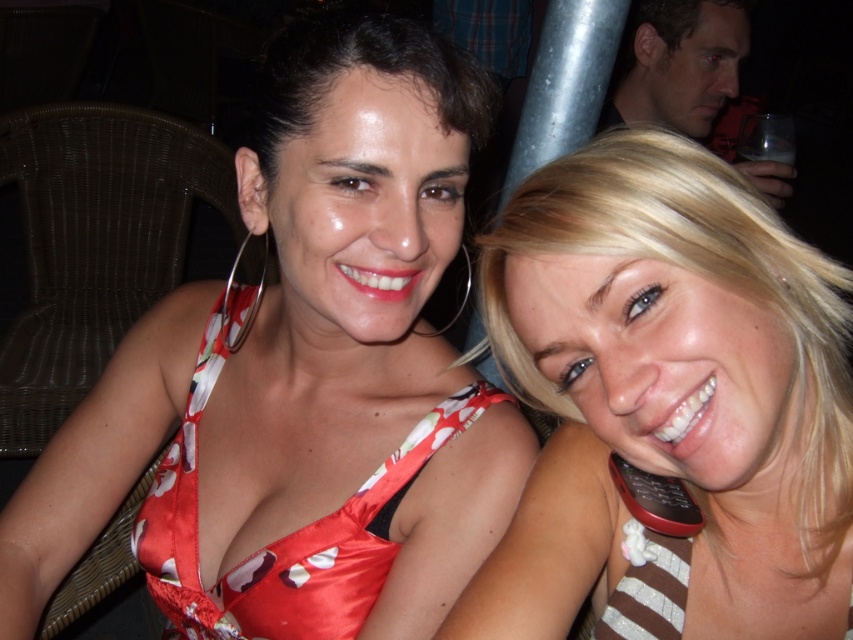
Question: Can you confirm if floral satin dress at center is positioned to the right of smooth glass at upper right?

Choices:
 (A) no
 (B) yes

Answer: (A)

Question: Does blonde hair at right appear on the left side of satin floral bikini top at center?

Choices:
 (A) no
 (B) yes

Answer: (A)

Question: Which of the following is the closest to the observer?

Choices:
 (A) (289, 506)
 (B) (715, 49)
 (C) (666, 296)
 (D) (183, 616)

Answer: (C)

Question: Which point is closer to the camera?

Choices:
 (A) satin floral bikini top at center
 (B) smooth glass at upper right
 (C) blonde hair at right
 (D) floral satin dress at center

Answer: (C)

Question: Does floral satin dress at center appear under smooth glass at upper right?

Choices:
 (A) yes
 (B) no

Answer: (A)

Question: Which point is closer to the camera?

Choices:
 (A) floral satin dress at center
 (B) blonde hair at right

Answer: (B)